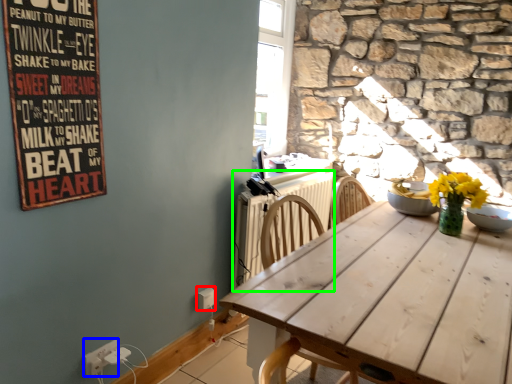
Question: Which is farther away from electric outlet (highlighted by a red box)? electric outlet (highlighted by a blue box) or radiator (highlighted by a green box)?

Choices:
 (A) electric outlet
 (B) radiator

Answer: (B)